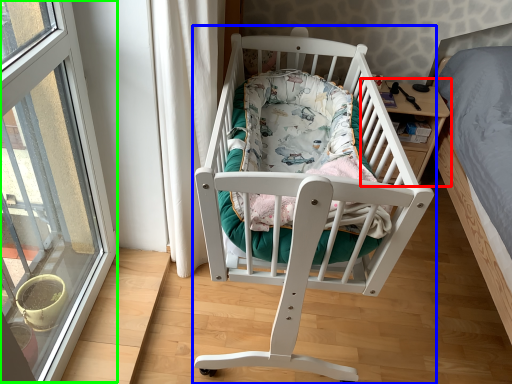
Question: Which is farther away from table (highlighted by a red box)? infant bed (highlighted by a blue box) or window (highlighted by a green box)?

Choices:
 (A) infant bed
 (B) window

Answer: (B)